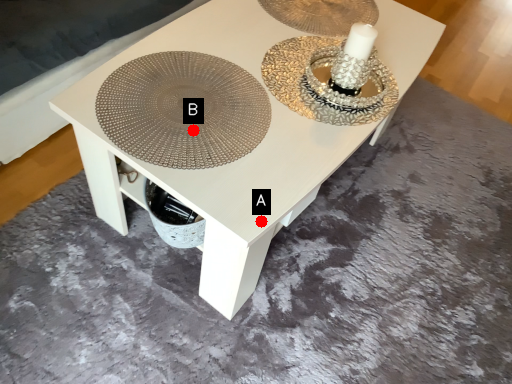
Question: Two points are circled on the image, labeled by A and B beside each circle. Which point is farther to the camera?

Choices:
 (A) A is further
 (B) B is further

Answer: (B)